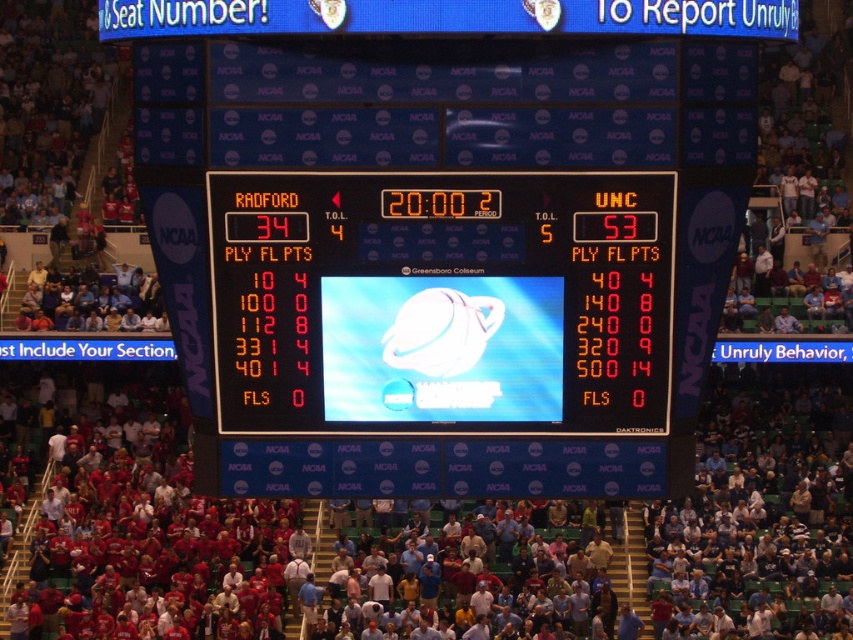
Question: Among these objects, which one is farthest from the camera?

Choices:
 (A) shiny blue planet at center
 (B) orange digital scoreboard at center

Answer: (A)

Question: Does orange digital scoreboard at center lie in front of shiny blue planet at center?

Choices:
 (A) yes
 (B) no

Answer: (A)

Question: Which object appears closest to the camera in this image?

Choices:
 (A) shiny blue planet at center
 (B) orange digital scoreboard at center

Answer: (B)

Question: Which of the following is the closest to the observer?

Choices:
 (A) shiny blue planet at center
 (B) orange digital scoreboard at center

Answer: (B)

Question: Can you confirm if orange digital scoreboard at center is positioned to the left of shiny blue planet at center?

Choices:
 (A) no
 (B) yes

Answer: (B)

Question: Can you confirm if orange digital scoreboard at center is thinner than shiny blue planet at center?

Choices:
 (A) no
 (B) yes

Answer: (A)